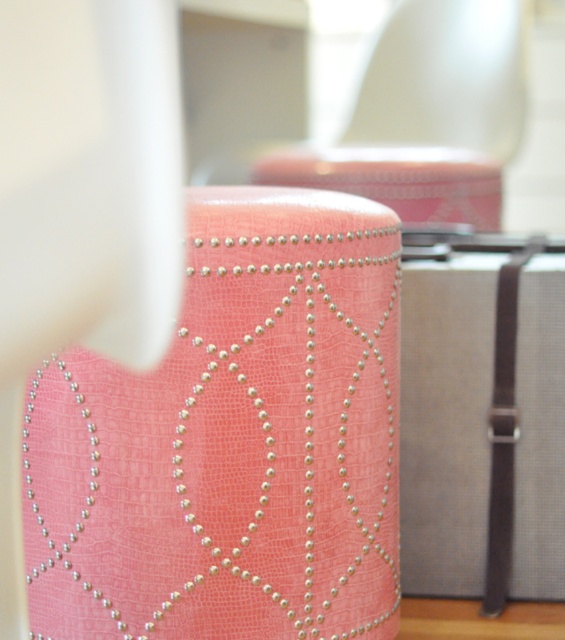
Is point (545, 365) positioned in front of point (521, 99)?

Yes, point (545, 365) is closer to viewer.

Between point (497, 515) and point (486, 189), which one is positioned in front?

Positioned in front is point (497, 515).

Image resolution: width=565 pixels, height=640 pixels. What do you see at coordinates (483, 417) in the screenshot? I see `gray fabric suitcase at center` at bounding box center [483, 417].

Where is `gray fabric suitcase at center`? Image resolution: width=565 pixels, height=640 pixels. gray fabric suitcase at center is located at coordinates (483, 417).

Does pearltextured fabricstool at center appear on the left side of gray fabric suitcase at center?

Correct, you'll find pearltextured fabricstool at center to the left of gray fabric suitcase at center.

Can you confirm if pearltextured fabricstool at center is positioned to the right of gray fabric suitcase at center?

In fact, pearltextured fabricstool at center is to the left of gray fabric suitcase at center.

The image size is (565, 640). What do you see at coordinates (232, 440) in the screenshot?
I see `pearltextured fabricstool at center` at bounding box center [232, 440].

Where is `pearltextured fabricstool at center`? This screenshot has width=565, height=640. pearltextured fabricstool at center is located at coordinates (232, 440).

Is pearltextured fabricstool at center above pink textured ottoman at upper center?

No, pearltextured fabricstool at center is not above pink textured ottoman at upper center.

Is point (308, 444) more distant than point (431, 209)?

No, it is not.

Locate an element on the screen. pearltextured fabricstool at center is located at coordinates (232, 440).